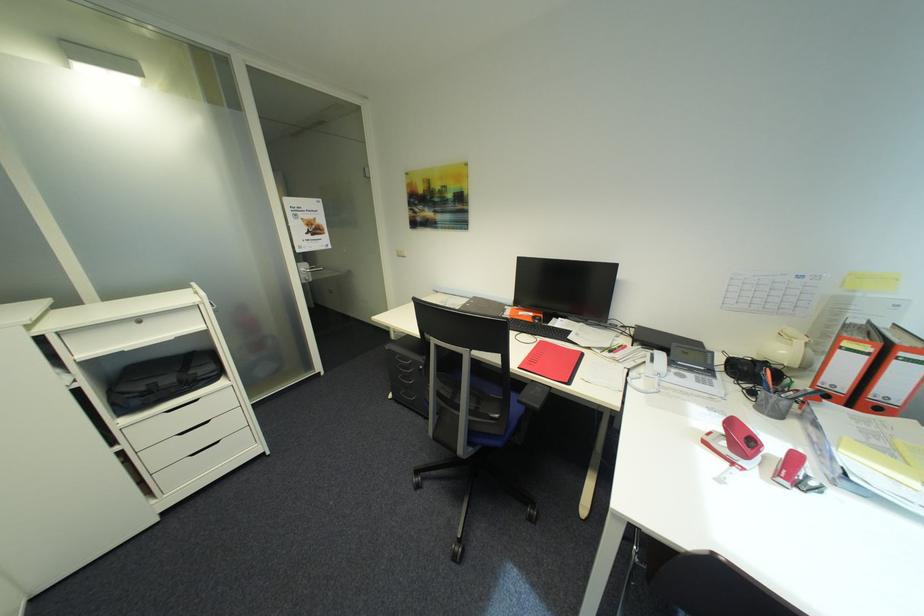
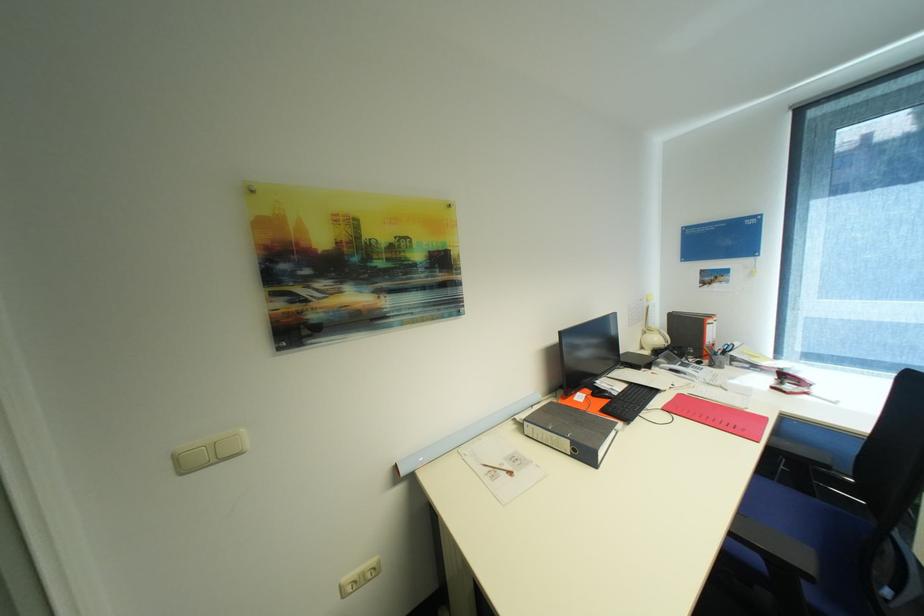
Where in the second image is the point corresponding to point (742, 464) from the first image?

(813, 394)